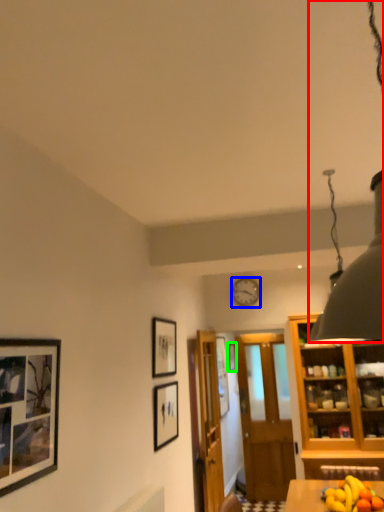
Question: Estimate the real-world distances between objects in this image. Which object is closer to light fixture (highlighted by a red box), picture frame (highlighted by a blue box) or picture frame (highlighted by a green box)?

Choices:
 (A) picture frame
 (B) picture frame

Answer: (A)